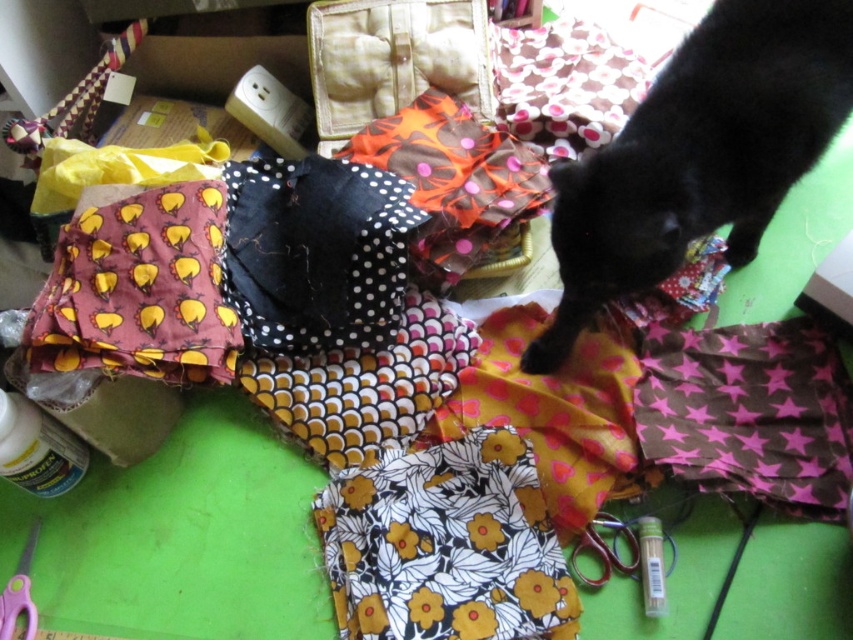
Question: Which point appears closest to the camera in this image?

Choices:
 (A) (196, 358)
 (B) (363, 193)
 (C) (590, 540)
 (D) (699, 454)

Answer: (C)

Question: Can you confirm if brown star-patterned fabric at lower right is positioned above pink plastic scissors at lower left?

Choices:
 (A) yes
 (B) no

Answer: (A)

Question: Among these objects, which one is farthest from the camera?

Choices:
 (A) brown star-patterned fabric at lower right
 (B) yellow polka dot fabric at center
 (C) black dotted fabric at center

Answer: (C)

Question: Can you confirm if black fur cat at upper right is smaller than metallic silver scissors at lower right?

Choices:
 (A) no
 (B) yes

Answer: (A)

Question: Estimate the real-world distances between objects in this image. Which object is farther from the black dotted fabric at center?

Choices:
 (A) pink plastic scissors at lower left
 (B) brown star-patterned fabric at lower right
 (C) black fur cat at upper right
 (D) metallic silver scissors at lower right

Answer: (A)

Question: Is black fur cat at upper right positioned at the back of pink plastic scissors at lower left?

Choices:
 (A) no
 (B) yes

Answer: (A)